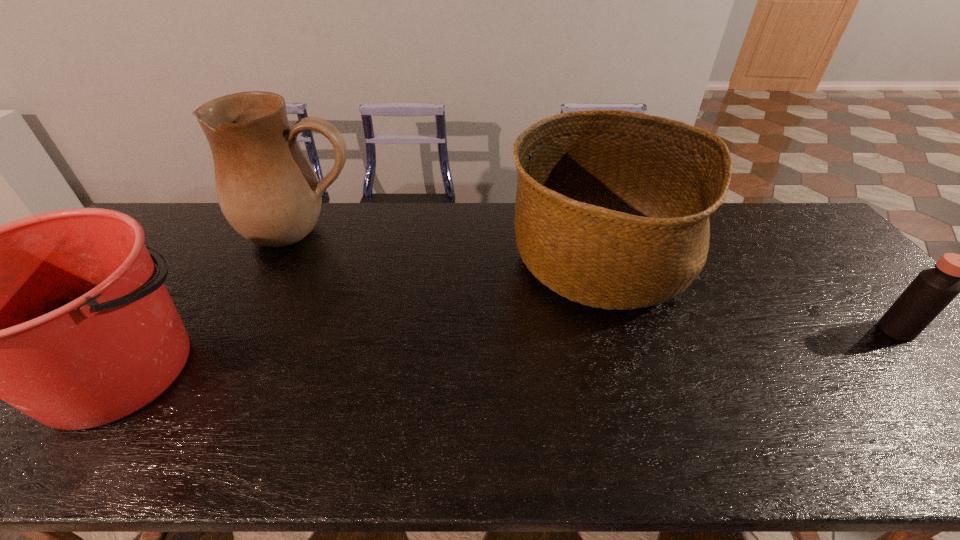
I want to click on cream pitcher, so click(x=267, y=189).

The width and height of the screenshot is (960, 540). Identify the location of the third object from left to right. [x=612, y=208].

Where is `the shortest object`? This screenshot has height=540, width=960. the shortest object is located at coordinates (933, 289).

Find the location of a particular element. This screenshot has width=960, height=540. the rightmost object is located at coordinates (933, 289).

At what (x,y) coordinates should I click in order to perform the action: click on free space located at the spout of the cream pitcher. Please return your answer as a coordinate pair (x, y). Image resolution: width=960 pixels, height=540 pixels. Looking at the image, I should click on (273, 291).

In order to click on vacant area situated 0.280m on the front of the basket in this screenshot , I will do `click(654, 434)`.

Where is `free point located on the back of the shortest object`? This screenshot has height=540, width=960. free point located on the back of the shortest object is located at coordinates (835, 265).

What are the coordinates of `cream pitcher situated at the far edge` in the screenshot? It's located at (267, 189).

This screenshot has width=960, height=540. I want to click on basket that is at the far edge, so click(612, 208).

The height and width of the screenshot is (540, 960). I want to click on object situated at the right edge, so click(x=933, y=289).